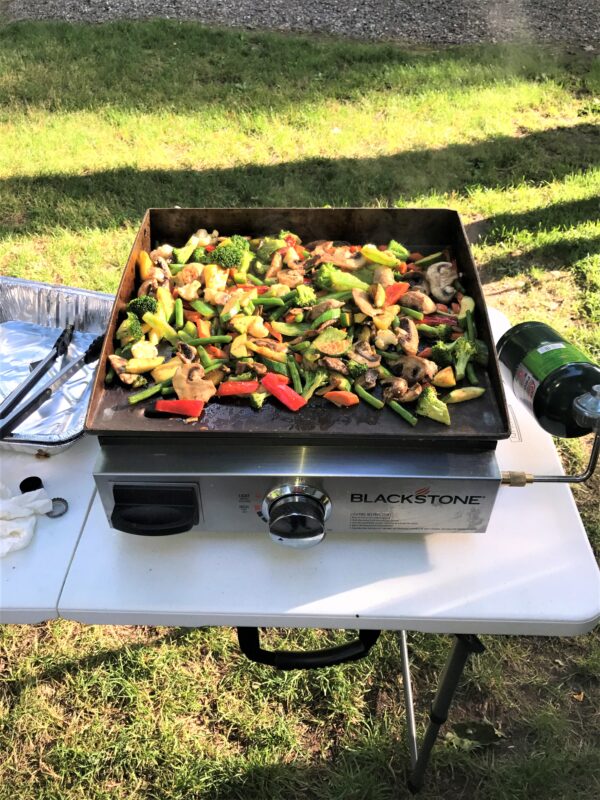
Find the location of a particular element. handle is located at coordinates (328, 650).